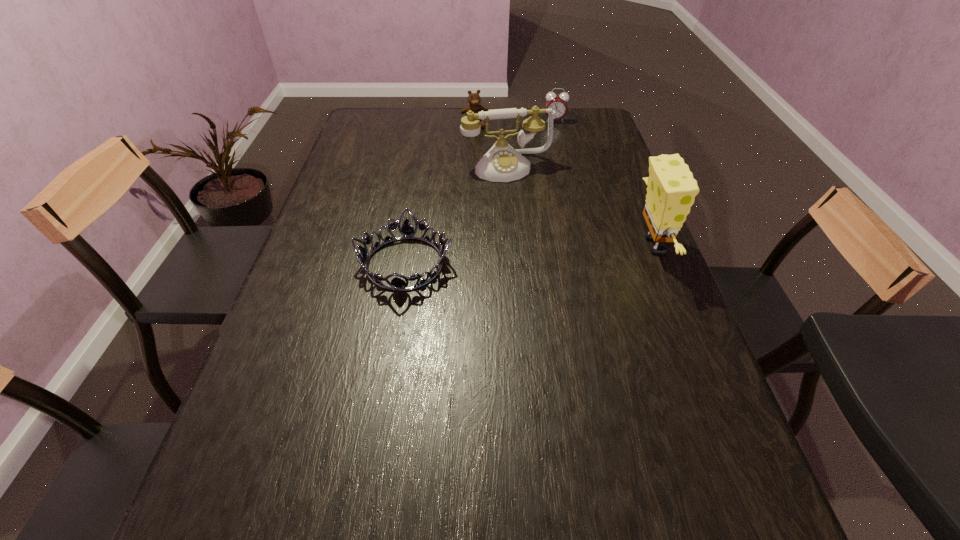
Find the location of a particular element. blank space located 0.390m at the face of the teddy bear is located at coordinates (499, 193).

This screenshot has height=540, width=960. I want to click on vacant region located 0.180m on the dial of the telephone, so click(528, 218).

This screenshot has height=540, width=960. What are the coordinates of `vacant space situated on the dial of the telephone` in the screenshot? It's located at (521, 201).

The image size is (960, 540). What are the coordinates of `free region located on the dial of the telephone` in the screenshot? It's located at (532, 230).

Locate an element on the screen. The width and height of the screenshot is (960, 540). vacant space situated on the clock face of the second object from right to left is located at coordinates (558, 179).

Locate an element on the screen. Image resolution: width=960 pixels, height=540 pixels. vacant position located 0.060m on the clock face of the second object from right to left is located at coordinates (555, 132).

Where is `free space located on the clock face of the second object from right to left`? Image resolution: width=960 pixels, height=540 pixels. free space located on the clock face of the second object from right to left is located at coordinates (558, 174).

Locate an element on the screen. The width and height of the screenshot is (960, 540). teddy bear that is positioned at the far edge is located at coordinates (474, 99).

What are the coordinates of `alarm clock that is at the far edge` in the screenshot? It's located at (558, 103).

Where is `object located at the left edge`? Image resolution: width=960 pixels, height=540 pixels. object located at the left edge is located at coordinates (407, 231).